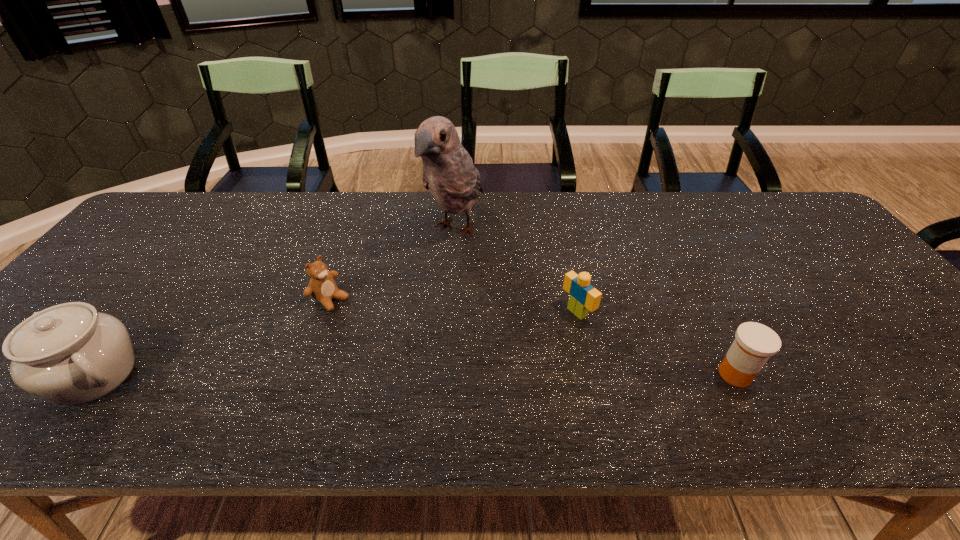
Where is `the fourth shortest object`? The width and height of the screenshot is (960, 540). the fourth shortest object is located at coordinates (70, 354).

At what (x,y) coordinates should I click in order to perform the action: click on the leftmost object. Please return your answer as a coordinate pair (x, y). The width and height of the screenshot is (960, 540). Looking at the image, I should click on (70, 354).

At what (x,y) coordinates should I click in order to perform the action: click on the rightmost object. Please return your answer as a coordinate pair (x, y). Looking at the image, I should click on (754, 343).

Identify the location of teddy bear. (322, 287).

Locate an element on the screen. The height and width of the screenshot is (540, 960). Lego is located at coordinates (583, 297).

You are a GUI agent. You are given a task and a screenshot of the screen. Output one action in this format:
    pyautogui.click(x=<x>, y=<y>)
    Task: Click on the tallest object
    This screenshot has height=540, width=960.
    Given the screenshot: What is the action you would take?
    pyautogui.click(x=449, y=174)

The height and width of the screenshot is (540, 960). I want to click on the third object from right to left, so click(449, 174).

You are a GUI agent. You are given a task and a screenshot of the screen. Output one action in this format:
    pyautogui.click(x=<x>, y=<y>)
    Task: Click on the free space located 0.200m on the back of the second tallest object
    This screenshot has width=960, height=540.
    Given the screenshot: What is the action you would take?
    pyautogui.click(x=166, y=281)

I want to click on vacant point located on the front-facing side of the fourth object from right to left, so click(384, 333).

Locate an element on the screen. This screenshot has height=540, width=960. free region located on the front-facing side of the fourth object from right to left is located at coordinates (372, 325).